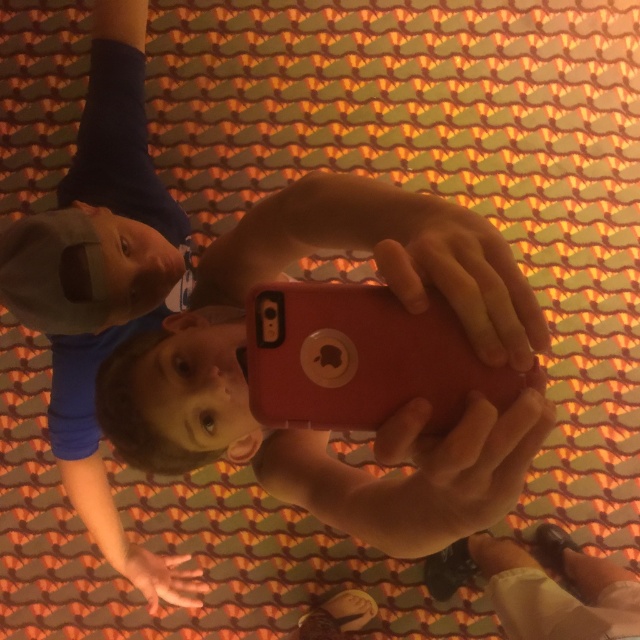
Question: Does matte red phone at center have a lesser width compared to smooth skin hand at center?

Choices:
 (A) yes
 (B) no

Answer: (B)

Question: Can you confirm if smooth skin at center is positioned to the left of smooth skin hand at center?

Choices:
 (A) yes
 (B) no

Answer: (B)

Question: Which of the following is the closest to the observer?

Choices:
 (A) (396, 273)
 (B) (113, 540)

Answer: (A)

Question: Which object is farther from the camera taking this photo?

Choices:
 (A) smooth skin hand at center
 (B) smooth skin at center
 (C) matte red phone at center

Answer: (A)

Question: Based on their relative distances, which object is nearer to the smooth skin at center?

Choices:
 (A) matte plastic phone at center
 (B) matte red phone at center
 (C) smooth skin hand at center

Answer: (B)

Question: Is matte red phone at center positioned behind smooth skin hand at center?

Choices:
 (A) yes
 (B) no

Answer: (B)